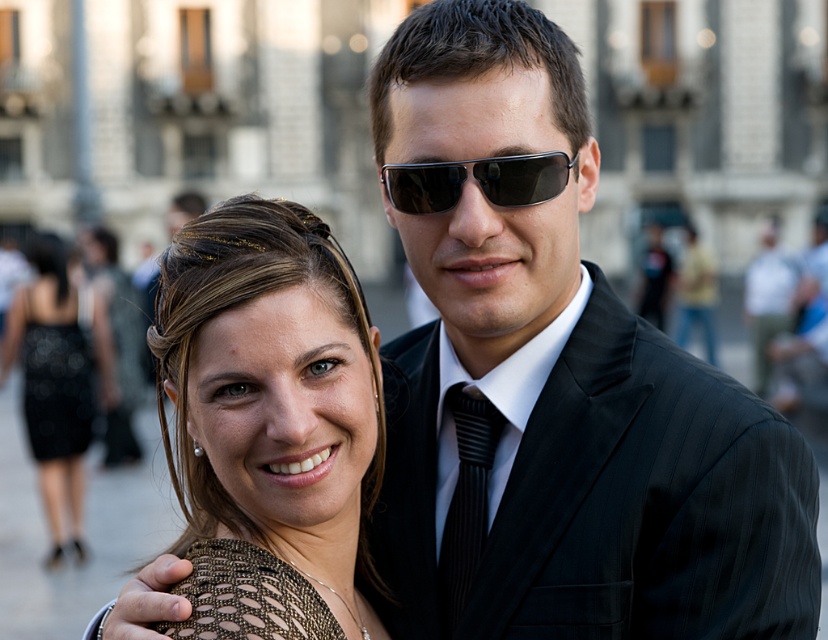
Question: Which is farther from the satin black dress at lower left?

Choices:
 (A) matte gold hair at center
 (B) black pinstripe suit at center
 (C) black satin dress at lower left
 (D) black plastic sunglasses at center

Answer: (D)

Question: Is satin black dress at lower left to the left of black satin dress at lower left from the viewer's perspective?

Choices:
 (A) yes
 (B) no

Answer: (B)

Question: Does satin black dress at lower left appear under black satin dress at lower left?

Choices:
 (A) yes
 (B) no

Answer: (A)

Question: Considering the real-world distances, which object is farthest from the black satin dress at lower left?

Choices:
 (A) black pinstripe suit at center
 (B) matte gold hair at center
 (C) black plastic sunglasses at center
 (D) black striped tie at center

Answer: (A)

Question: Which point is closer to the camera?

Choices:
 (A) satin black dress at lower left
 (B) black pinstripe suit at center
 (C) black striped tie at center
 (D) black satin dress at lower left

Answer: (B)

Question: Can you confirm if black pinstripe suit at center is smaller than black plastic sunglasses at center?

Choices:
 (A) no
 (B) yes

Answer: (A)